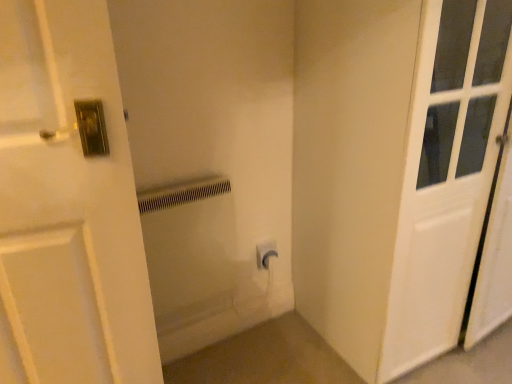
Question: From the image's perspective, is white plastic radiator at center above or below white matte door at right?

Choices:
 (A) above
 (B) below

Answer: (B)

Question: Considering the relative positions of white plastic radiator at center and white matte door at right in the image provided, is white plastic radiator at center to the left or to the right of white matte door at right?

Choices:
 (A) left
 (B) right

Answer: (A)

Question: Estimate the real-world distances between objects in this image. Which object is closer to the white matte door at right?

Choices:
 (A) white plastic radiator at center
 (B) white plastic electric outlet at center

Answer: (A)

Question: Considering the real-world distances, which object is closest to the white plastic radiator at center?

Choices:
 (A) white matte door at right
 (B) white plastic electric outlet at center

Answer: (B)